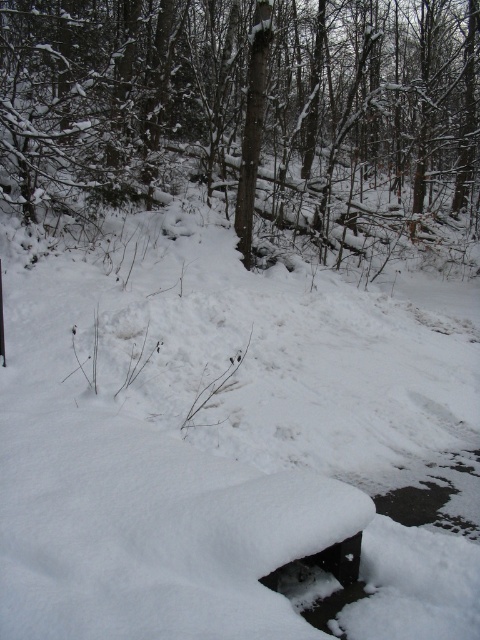
Question: Which point is farther to the camera?

Choices:
 (A) white fluffy snow at center
 (B) smooth brown tree trunk at center

Answer: (B)

Question: Is white fluffy snow at center wider than smooth brown tree trunk at center?

Choices:
 (A) no
 (B) yes

Answer: (A)

Question: Does white fluffy snow at center have a smaller size compared to smooth brown tree trunk at center?

Choices:
 (A) yes
 (B) no

Answer: (A)

Question: Is white fluffy snow at center above smooth brown tree trunk at center?

Choices:
 (A) no
 (B) yes

Answer: (A)

Question: Which of the following is the farthest from the observer?

Choices:
 (A) (109, 22)
 (B) (411, 602)

Answer: (A)